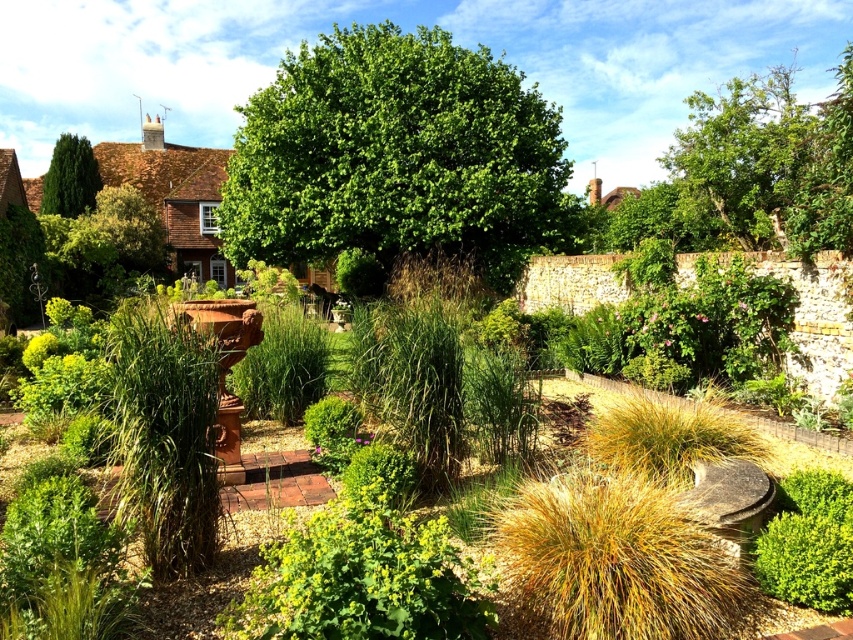
Looking at this image, is green leafy tree at center below green leafy bush at lower right?

Actually, green leafy tree at center is above green leafy bush at lower right.

Image resolution: width=853 pixels, height=640 pixels. Describe the element at coordinates (397, 156) in the screenshot. I see `green leafy tree at center` at that location.

Between point (494, 186) and point (798, 556), which one is positioned behind?

Positioned behind is point (494, 186).

Locate an element on the screen. This screenshot has height=640, width=853. green leafy tree at center is located at coordinates (397, 156).

Can you confirm if green leafy bush at lower right is positioned to the left of green glossy tree at upper left?

No, green leafy bush at lower right is not to the left of green glossy tree at upper left.

Is green leafy bush at lower right further to the viewer compared to green glossy tree at upper left?

No, green leafy bush at lower right is closer to the viewer.

Does point (845, 502) come in front of point (62, 134)?

Yes, point (845, 502) is closer to viewer.

Where is `green leafy bush at lower right`? green leafy bush at lower right is located at coordinates (809, 541).

Between green leafy tree at center and green glossy tree at upper left, which one is positioned lower?

Positioned lower is green leafy tree at center.

Which of these two, green leafy tree at center or green glossy tree at upper left, stands taller?

With more height is green leafy tree at center.

The height and width of the screenshot is (640, 853). Identify the location of green leafy tree at center. (397, 156).

Find the location of `green leafy tree at center`. green leafy tree at center is located at coordinates (397, 156).